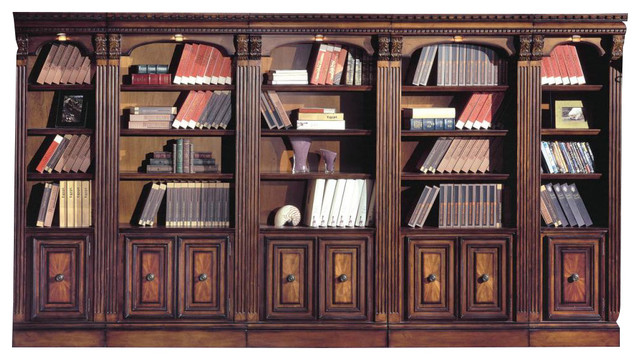
Where is `3rd shelf`? Image resolution: width=640 pixels, height=360 pixels. 3rd shelf is located at coordinates (33, 131), (226, 137), (305, 128), (463, 133), (576, 133).